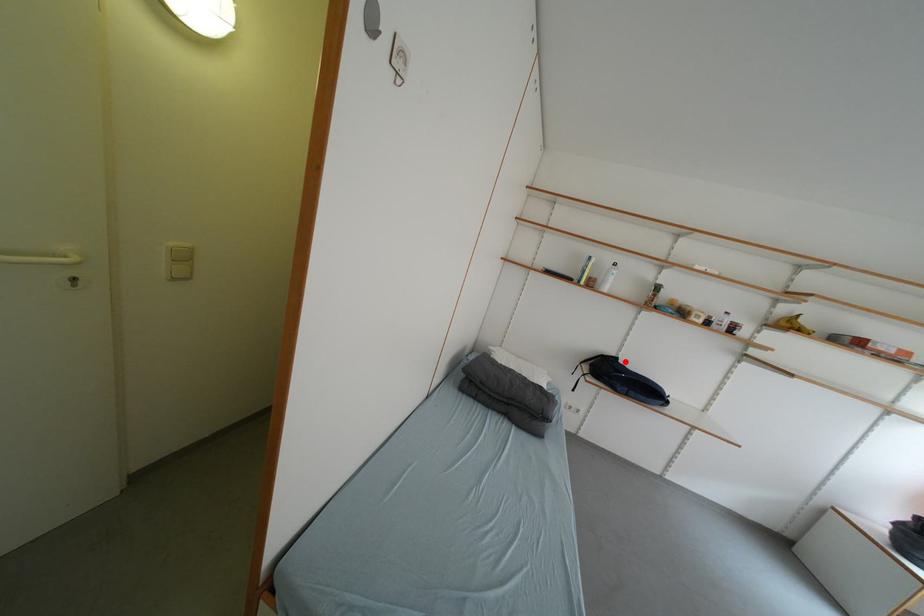
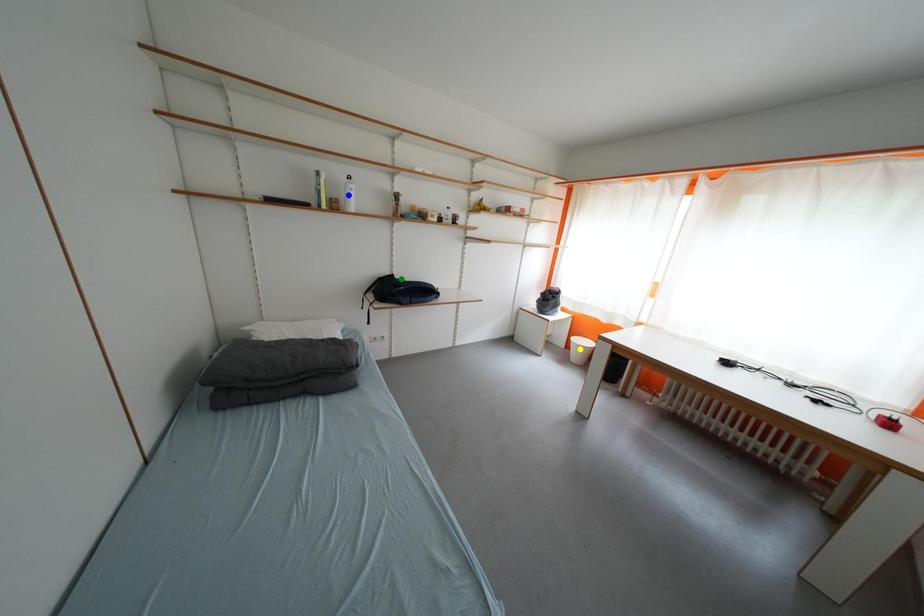
Question: I am providing you with two images of the same scene from different viewpoints. A red point is marked on the first image. You are given multiple points on the second image. In image 2, which mark is for the same physical point as the one in image 1?

Choices:
 (A) green point
 (B) yellow point
 (C) blue point

Answer: (A)